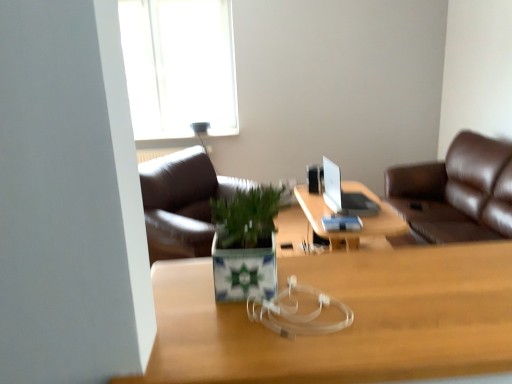
Describe the element at coordinates (344, 194) in the screenshot. I see `silver metallic laptop at center` at that location.

Identify the location of wooden desk at center. This screenshot has width=512, height=384. (348, 327).

Measure the distance between point (220, 274) and camera.

A distance of 30.16 inches exists between point (220, 274) and camera.

In the scene shown: In order to face green ceramic pot at center, should I rotate leftwards or rightwards?

To align with it, rotate left about 0.117°.

What do you see at coordinates (179, 66) in the screenshot? I see `transparent glass window at upper center` at bounding box center [179, 66].

Identify the location of wooden table at center. The width and height of the screenshot is (512, 384). (361, 217).

In order to face wooden table at center, should I rotate leftwards or rightwards?

You should look right and rotate roughly 10.864 degrees.

Locate an element on the screen. Image resolution: width=512 pixels, height=384 pixels. silver metallic laptop at center is located at coordinates (344, 194).

Is green ceramic pot at center turned away from silver metallic laptop at center?

No.

Based on their positions, is green ceramic pot at center located to the left or right of silver metallic laptop at center?

Clearly, green ceramic pot at center is on the left of silver metallic laptop at center in the image.

Is green ceramic pot at center shorter than silver metallic laptop at center?

Yes.

In the scene shown: What's the angular difference between green ceramic pot at center and silver metallic laptop at center's facing directions?

They differ by 88 degrees in their facing directions.

Choose the correct answer: Is silver metallic laptop at center inside wooden table at center or outside it?

silver metallic laptop at center is outside wooden table at center.

Can you confirm if silver metallic laptop at center is wider than wooden table at center?

Incorrect, the width of silver metallic laptop at center does not surpass that of wooden table at center.

In terms of size, does silver metallic laptop at center appear bigger or smaller than wooden table at center?

silver metallic laptop at center is smaller than wooden table at center.

Considering the sizes of objects green ceramic pot at center and transparent glass window at upper center in the image provided, who is bigger, green ceramic pot at center or transparent glass window at upper center?

transparent glass window at upper center.

From a real-world perspective, is green ceramic pot at center positioned under transparent glass window at upper center based on gravity?

Indeed, from a real-world perspective, green ceramic pot at center is positioned beneath transparent glass window at upper center.

Find the location of a particular element. Image resolution: width=512 pixels, height=384 pixels. window that appears on the left of green ceramic pot at center is located at coordinates (179, 66).

Which is more to the right, transparent glass window at upper center or wooden desk at center?

wooden desk at center is more to the right.

Between transparent glass window at upper center and wooden desk at center, which one is positioned in front?

Positioned in front is wooden desk at center.

Between transparent glass window at upper center and wooden desk at center, which one has larger width?

With larger width is wooden desk at center.

Does point (350, 188) come farther from viewer compared to point (224, 239)?

Yes, it is.

How much distance is there between wooden table at center and green ceramic pot at center?

wooden table at center and green ceramic pot at center are 6.52 feet apart from each other.

From the image's perspective, which is below, wooden table at center or green ceramic pot at center?

wooden table at center, from the image's perspective.

In terms of width, does wooden table at center look wider or thinner when compared to green ceramic pot at center?

wooden table at center is wider than green ceramic pot at center.

From a real-world perspective, is silver metallic laptop at center below wooden desk at center?

Indeed, from a real-world perspective, silver metallic laptop at center is positioned beneath wooden desk at center.

Between silver metallic laptop at center and wooden desk at center, which one has smaller size?

With smaller size is wooden desk at center.

How far apart are silver metallic laptop at center and wooden desk at center?

The distance of silver metallic laptop at center from wooden desk at center is 6.28 feet.

Is silver metallic laptop at center shorter than wooden desk at center?

No.

Is wooden desk at center far away from silver metallic laptop at center?

Yes.

Can you confirm if wooden desk at center is smaller than silver metallic laptop at center?

Indeed, wooden desk at center has a smaller size compared to silver metallic laptop at center.

From the image's perspective, is wooden desk at center above silver metallic laptop at center?

No, from the image's perspective, wooden desk at center is not above silver metallic laptop at center.

Is silver metallic laptop at center at the back of wooden desk at center?

That's not correct — wooden desk at center is not looking away from silver metallic laptop at center.

There is a silver metallic laptop at center. Identify the location of houseplant above it (from a real-world perspective). The image size is (512, 384). (245, 244).

I want to click on table located underneath the silver metallic laptop at center (from a real-world perspective), so click(x=361, y=217).

Based on their spatial positions, is silver metallic laptop at center or transparent glass window at upper center closer to green ceramic pot at center?

silver metallic laptop at center.

In the scene shown: Considering their positions, is transparent glass window at upper center positioned further to wooden desk at center than wooden table at center?

The object further to wooden desk at center is transparent glass window at upper center.

From the picture: Estimate the real-world distances between objects in this image. Which object is further from silver metallic laptop at center, green ceramic pot at center or wooden desk at center?

green ceramic pot at center lies further to silver metallic laptop at center than the other object.

Looking at this image, which object lies nearer to the anchor point transparent glass window at upper center, wooden table at center or green ceramic pot at center?

wooden table at center lies closer to transparent glass window at upper center than the other object.

In the scene shown: Considering their positions, is transparent glass window at upper center positioned further to wooden desk at center than green ceramic pot at center?

Based on the image, transparent glass window at upper center appears to be further to wooden desk at center.

From the image, which object appears to be nearer to wooden desk at center, wooden table at center or transparent glass window at upper center?

wooden table at center.

Based on their spatial positions, is wooden table at center or green ceramic pot at center further from silver metallic laptop at center?

Based on the image, green ceramic pot at center appears to be further to silver metallic laptop at center.

Estimate the real-world distances between objects in this image. Which object is further from wooden desk at center, silver metallic laptop at center or green ceramic pot at center?

silver metallic laptop at center is further to wooden desk at center.

Where is `houseplant positioned between wooden desk at center and wooden table at center from near to far`? The width and height of the screenshot is (512, 384). houseplant positioned between wooden desk at center and wooden table at center from near to far is located at coordinates (245, 244).

Identify the location of houseplant between wooden desk at center and transparent glass window at upper center from front to back. The width and height of the screenshot is (512, 384). (245, 244).

Find the location of a particular element. Image resolution: width=512 pixels, height=384 pixels. table located between green ceramic pot at center and transparent glass window at upper center in the depth direction is located at coordinates (361, 217).

Find the location of a particular element. Image resolution: width=512 pixels, height=384 pixels. laptop positioned between wooden table at center and transparent glass window at upper center from near to far is located at coordinates (344, 194).